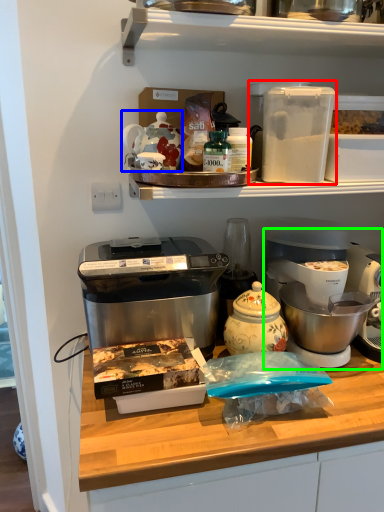
Question: Which object is the closest to the appliance (highlighted by a red box)? Choose among these: appliance (highlighted by a blue box) or coffee maker (highlighted by a green box).

Choices:
 (A) appliance
 (B) coffee maker

Answer: (A)